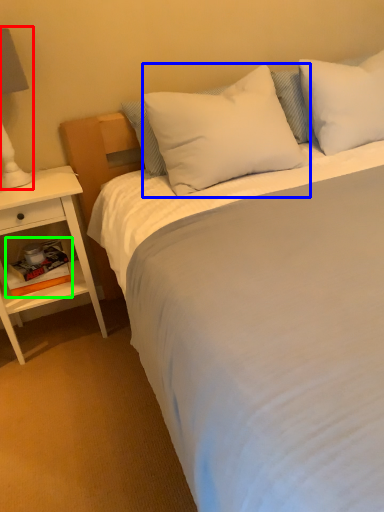
Question: Estimate the real-world distances between objects in this image. Which object is closer to bedside lamp (highlighted by a red box), pillow (highlighted by a blue box) or book (highlighted by a green box)?

Choices:
 (A) pillow
 (B) book

Answer: (B)